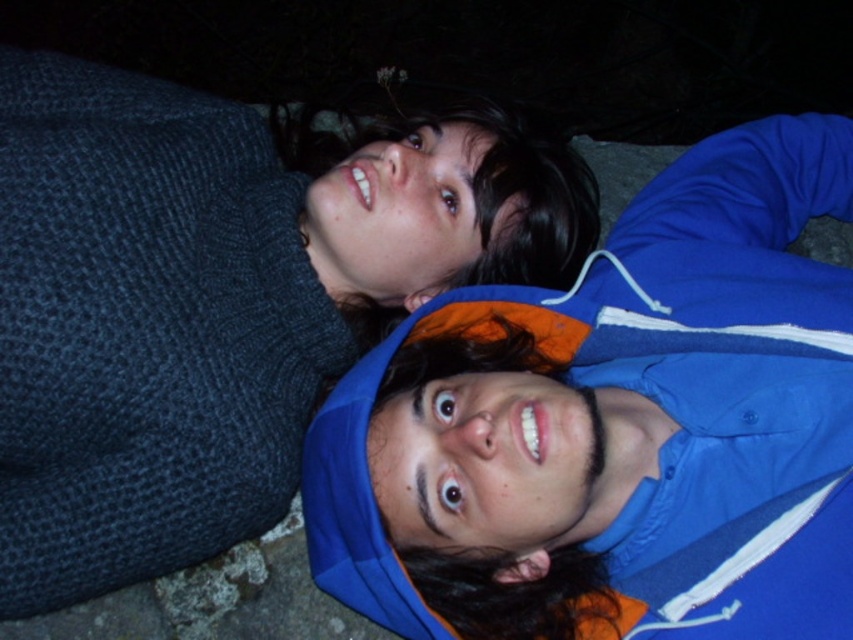
You are standing in a dark area and see two points in the scene. The first point is labeled as point (656, 275) and the second is point (556, 148). Which point is closer to you?

Point (656, 275) is in front of point (556, 148), so it is closer to you.

You are a photographer trying to capture a photo of the blue fabric jacket at upper center and the knitted dark blue sweater at upper left. Since the background is dark, you want to adjust the camera focus to ensure both are clear. Which object should you focus on first if you want to prioritize the one closer to the camera?

The blue fabric jacket at upper center is closer to the camera than the knitted dark blue sweater at upper left because it has a lesser height, so you should focus on the blue fabric jacket at upper center first.

You are a photographer trying to capture a closeup of the blue fabric jacket at upper center. Given that your camera can only focus on objects within a 0.5 unit radius from the center point, will the jacket be in focus?

The blue fabric jacket at upper center is positioned at point (616, 417). The distance from the center point is sqrt of 0.653 squared plus 0.723 squared, which is approximately 0.976 units. Since this exceeds the 0.5 unit radius, the jacket will not be in focus.